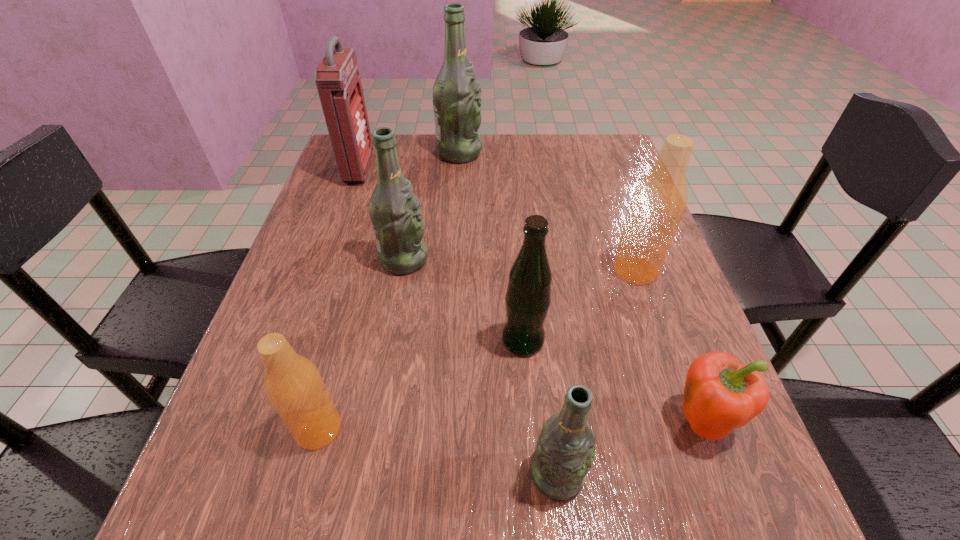
At what (x,y) coordinates should I click in order to perform the action: click on blank region between the farther tan beer bottle and the pepper. Please return your answer as a coordinate pair (x, y). The height and width of the screenshot is (540, 960). Looking at the image, I should click on (669, 346).

Find the location of a particular element. free space between the tallest beer bottle and the first-aid kit is located at coordinates (409, 161).

Identify the location of object that is the second closest to the shortest object. The image size is (960, 540). (528, 296).

Identify which object is the sixth nearest to the right tan beer bottle. Please provide its 2D coordinates. Your answer should be formatted as a tuple, i.e. [(x, y)], where the tuple contains the x and y coordinates of a point satisfying the conditions above.

[(292, 383)]

Locate an element on the screen. The width and height of the screenshot is (960, 540). beer bottle that can be found as the fourth closest to the bigger tan beer bottle is located at coordinates (456, 93).

You are a GUI agent. You are given a task and a screenshot of the screen. Output one action in this format:
    pyautogui.click(x=<x>, y=<y>)
    Task: Click on the second closest beer bottle to the leftmost object
    The width and height of the screenshot is (960, 540).
    Given the screenshot: What is the action you would take?
    pyautogui.click(x=395, y=212)

What are the coordinates of `green beer bottle that is the third closest one to the bigger tan beer bottle` in the screenshot? It's located at (395, 212).

Select which green beer bottle is the closest to the red first-aid kit. Please provide its 2D coordinates. Your answer should be formatted as a tuple, i.e. [(x, y)], where the tuple contains the x and y coordinates of a point satisfying the conditions above.

[(456, 93)]

The image size is (960, 540). What are the coordinates of `vacant space that satisfies the following two spatial constraints: 1. on the front-facing side of the leftmost object; 2. on the left side of the left tan beer bottle` in the screenshot? It's located at (270, 429).

At what (x,y) coordinates should I click in order to perform the action: click on vacant space that satisfies the following two spatial constraints: 1. on the surface of the second farthest green beer bottle; 2. on the left side of the shortest object. Please return your answer as a coordinate pair (x, y). Looking at the image, I should click on (375, 421).